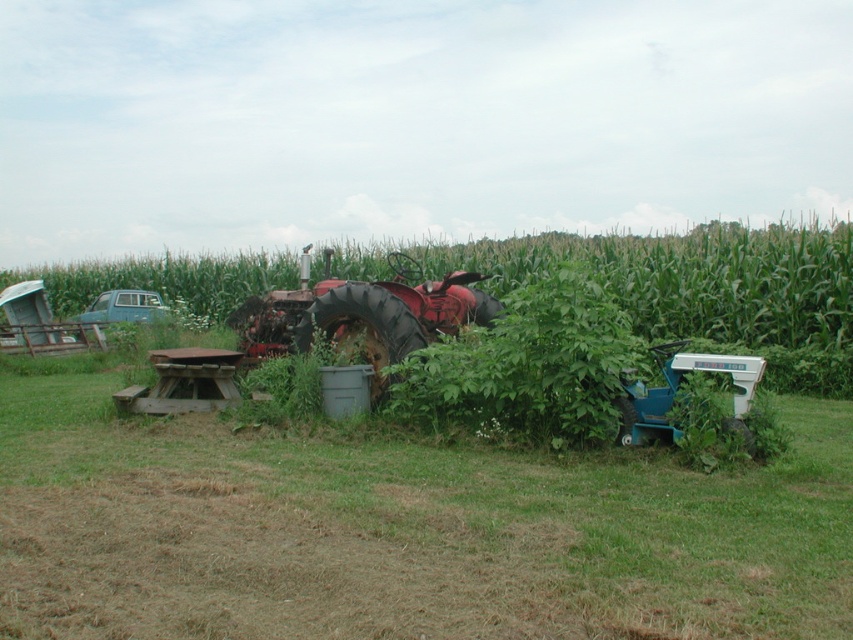
Question: Which object is the farthest from the green leafy corn at center?

Choices:
 (A) green grass at center
 (B) rusty metal tractor at center
 (C) teal plastic tractor at lower right

Answer: (A)

Question: Which object appears farthest from the camera in this image?

Choices:
 (A) green leafy corn at center
 (B) green grass at center
 (C) rusty metal tractor at center
 (D) teal plastic tractor at lower right

Answer: (A)

Question: Is rusty metal tractor at center to the left of teal plastic tractor at lower right from the viewer's perspective?

Choices:
 (A) yes
 (B) no

Answer: (A)

Question: Is rusty metal tractor at center smaller than teal plastic tractor at lower right?

Choices:
 (A) yes
 (B) no

Answer: (B)

Question: Which object is positioned farthest from the green leafy corn at center?

Choices:
 (A) green grass at center
 (B) teal plastic tractor at lower right

Answer: (A)

Question: Considering the relative positions of green grass at center and rusty metal tractor at center in the image provided, where is green grass at center located with respect to rusty metal tractor at center?

Choices:
 (A) right
 (B) left

Answer: (A)